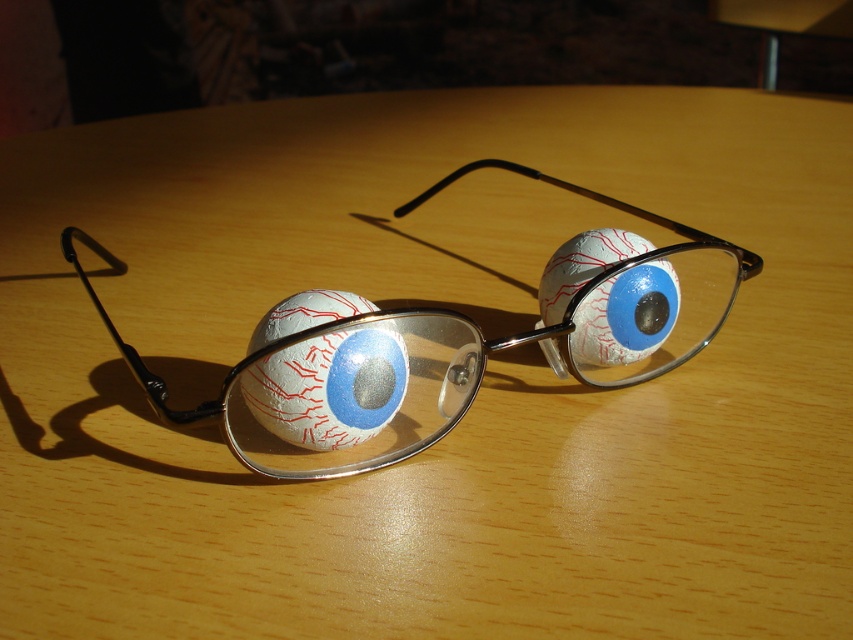
Is the position of metallic silver glasses at center more distant than that of white matte eyeball at center?

No, metallic silver glasses at center is in front of white matte eyeball at center.

Is point (409, 324) positioned before point (607, 330)?

Yes.

Where is `metallic silver glasses at center`? This screenshot has width=853, height=640. metallic silver glasses at center is located at coordinates [444, 353].

Where is `white textured baseball at center`? The width and height of the screenshot is (853, 640). white textured baseball at center is located at coordinates (329, 387).

Who is positioned more to the left, white textured baseball at center or white matte eyeball at center?

white textured baseball at center is more to the left.

Who is more forward, (x=372, y=413) or (x=606, y=232)?

Point (x=372, y=413) is more forward.

At what (x,y) coordinates should I click in order to perform the action: click on white textured baseball at center. Please return your answer as a coordinate pair (x, y). The image size is (853, 640). Looking at the image, I should click on (329, 387).

What do you see at coordinates (444, 353) in the screenshot? I see `metallic silver glasses at center` at bounding box center [444, 353].

Can you confirm if metallic silver glasses at center is shorter than white textured baseball at center?

In fact, metallic silver glasses at center may be taller than white textured baseball at center.

What do you see at coordinates (444, 353) in the screenshot? The image size is (853, 640). I see `metallic silver glasses at center` at bounding box center [444, 353].

Identify the location of metallic silver glasses at center. The height and width of the screenshot is (640, 853). (444, 353).